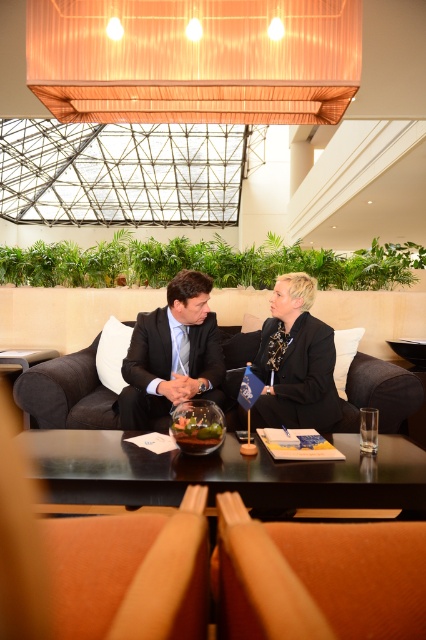
Is black suit at center to the right of black fabric couch at center from the viewer's perspective?

Yes, black suit at center is to the right of black fabric couch at center.

Which is above, black suit at center or black fabric couch at center?

black suit at center is higher up.

Is point (143, 417) positioned in front of point (365, 362)?

Yes, it is.

Find the location of a particular element. black suit at center is located at coordinates (298, 360).

Is black glass table at center to the left of black fabric couch at center from the viewer's perspective?

In fact, black glass table at center is to the right of black fabric couch at center.

Who is more forward, (81, 483) or (60, 412)?

Point (81, 483) is in front.

This screenshot has height=640, width=426. Identify the location of black glass table at center. (224, 472).

Is point (284, 388) behind point (132, 392)?

Yes, point (284, 388) is behind point (132, 392).

The height and width of the screenshot is (640, 426). What do you see at coordinates (298, 360) in the screenshot?
I see `black suit at center` at bounding box center [298, 360].

Does point (299, 396) come farther from viewer compared to point (158, 333)?

No, (299, 396) is closer to viewer.

You are a GUI agent. You are given a task and a screenshot of the screen. Output one action in this format:
    pyautogui.click(x=<x>, y=<y>)
    Task: Click on the black suit at center
    
    Given the screenshot: What is the action you would take?
    pyautogui.click(x=298, y=360)